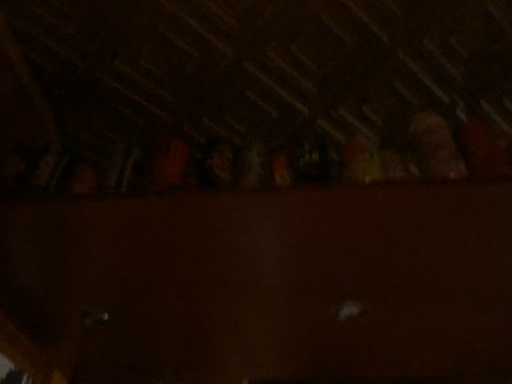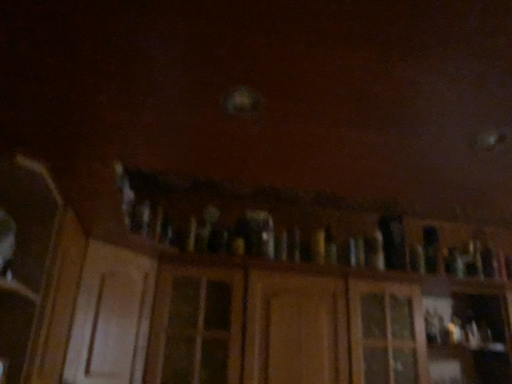
Question: How did the camera likely rotate when shooting the video?

Choices:
 (A) rotated left
 (B) rotated right

Answer: (B)